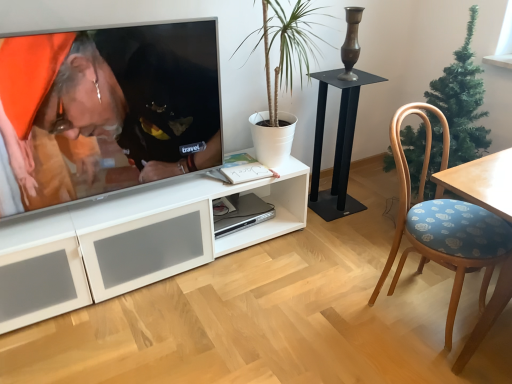
The image size is (512, 384). I want to click on blank space situated above black metal table at center (from a real-world perspective), so click(348, 79).